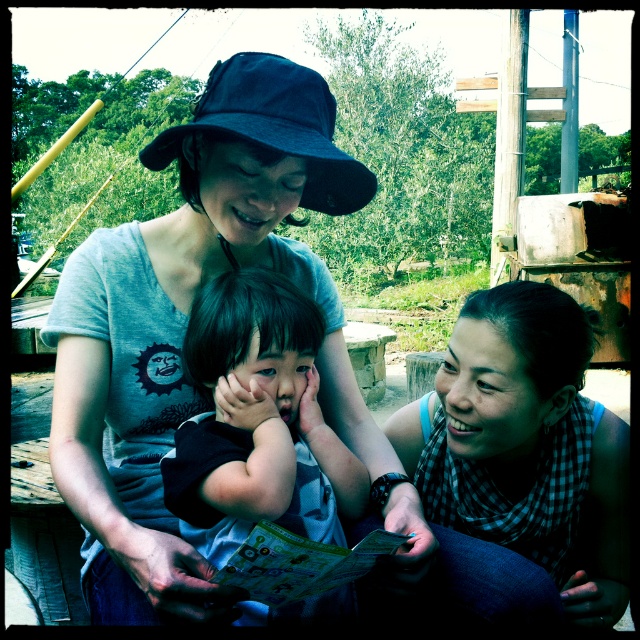
Question: Does matte gray shirt at center appear on the left side of checkered fabric at center?

Choices:
 (A) yes
 (B) no

Answer: (A)

Question: Considering the relative positions of black matte baby at center and dark blue fabric baseball hat at upper center in the image provided, where is black matte baby at center located with respect to dark blue fabric baseball hat at upper center?

Choices:
 (A) right
 (B) left

Answer: (A)

Question: Which point is closer to the camera taking this photo?

Choices:
 (A) (196, 481)
 (B) (106, 346)
 (C) (525, 522)

Answer: (A)

Question: Among these points, which one is farthest from the camera?

Choices:
 (A) (564, 484)
 (B) (209, 488)
 (C) (132, 536)

Answer: (A)

Question: Considering the real-world distances, which object is farthest from the dark blue fabric baseball hat at upper center?

Choices:
 (A) matte gray shirt at center
 (B) black matte baby at center
 (C) checkered fabric at center

Answer: (C)

Question: Is black matte baby at center to the left of dark blue fabric baseball hat at upper center from the viewer's perspective?

Choices:
 (A) yes
 (B) no

Answer: (B)